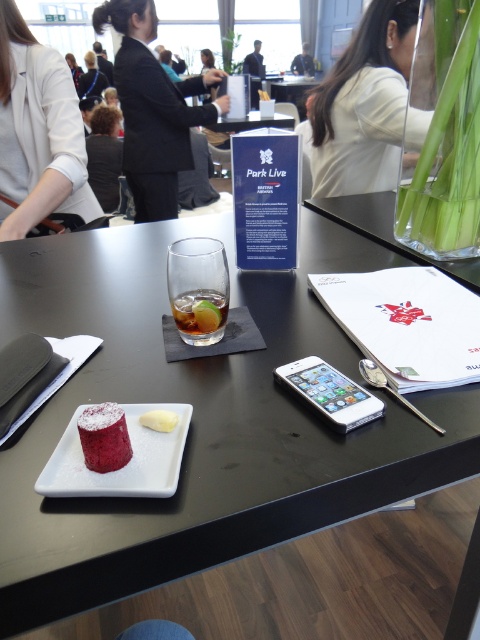
Question: Is black suit at center to the left of dark blue suit at center from the viewer's perspective?

Choices:
 (A) yes
 (B) no

Answer: (A)

Question: Can you confirm if white fabric shirt at upper left is bigger than translucent glass at center?

Choices:
 (A) no
 (B) yes

Answer: (B)

Question: Which point is farther to the camera?

Choices:
 (A) (71, 282)
 (B) (224, 317)
 (C) (23, 115)

Answer: (C)

Question: Estimate the real-world distances between objects in this image. Which object is closer to the white fabric shirt at upper left?

Choices:
 (A) clear glass at center
 (B) matte white plate at center
 (C) smooth pink cake at center
 (D) dark blue suit at center

Answer: (A)

Question: Does smooth pink cake at center have a larger size compared to white creamy cheese at center?

Choices:
 (A) no
 (B) yes

Answer: (B)

Question: Which of the following is the farthest from the observer?

Choices:
 (A) (72, 76)
 (B) (88, 54)
 (C) (191, 406)
 (D) (167, 420)

Answer: (B)